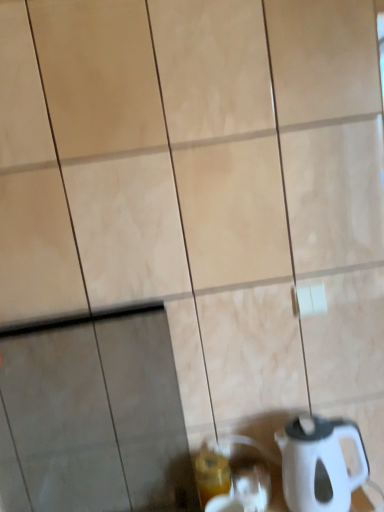
Question: Can you confirm if white plastic kettle at lower right is smaller than translucent glass beverage at lower center?

Choices:
 (A) yes
 (B) no

Answer: (B)

Question: Considering the relative sizes of white plastic kettle at lower right and translucent glass beverage at lower center in the image provided, is white plastic kettle at lower right wider than translucent glass beverage at lower center?

Choices:
 (A) yes
 (B) no

Answer: (A)

Question: Is white plastic kettle at lower right completely or partially outside of translucent glass beverage at lower center?

Choices:
 (A) no
 (B) yes

Answer: (B)

Question: Is white plastic kettle at lower right not near translucent glass beverage at lower center?

Choices:
 (A) yes
 (B) no

Answer: (B)

Question: Is white plastic kettle at lower right placed right next to translucent glass beverage at lower center?

Choices:
 (A) no
 (B) yes

Answer: (A)

Question: Does white plastic kettle at lower right have a greater height compared to translucent glass beverage at lower center?

Choices:
 (A) yes
 (B) no

Answer: (A)

Question: Is translucent glass beverage at lower center at the right side of white plastic kettle at lower right?

Choices:
 (A) no
 (B) yes

Answer: (A)

Question: Are translucent glass beverage at lower center and white plastic kettle at lower right beside each other?

Choices:
 (A) yes
 (B) no

Answer: (B)

Question: From a real-world perspective, is translucent glass beverage at lower center on white plastic kettle at lower right?

Choices:
 (A) no
 (B) yes

Answer: (A)

Question: Does translucent glass beverage at lower center lie in front of white plastic kettle at lower right?

Choices:
 (A) yes
 (B) no

Answer: (B)

Question: Would you consider translucent glass beverage at lower center to be distant from white plastic kettle at lower right?

Choices:
 (A) yes
 (B) no

Answer: (B)

Question: Is translucent glass beverage at lower center oriented away from white plastic kettle at lower right?

Choices:
 (A) yes
 (B) no

Answer: (B)

Question: Is white plastic kettle at lower right to the left or to the right of translucent glass beverage at lower center in the image?

Choices:
 (A) right
 (B) left

Answer: (A)